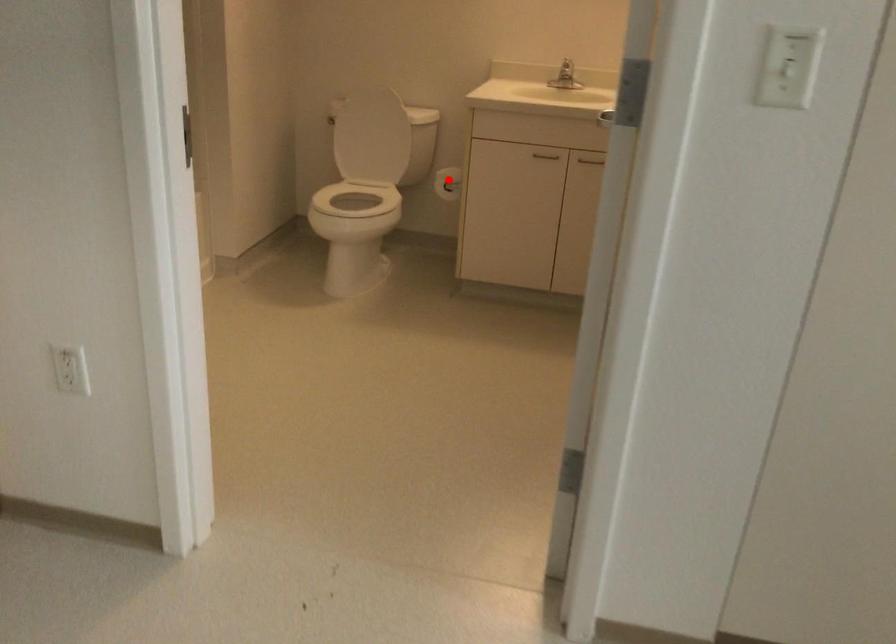
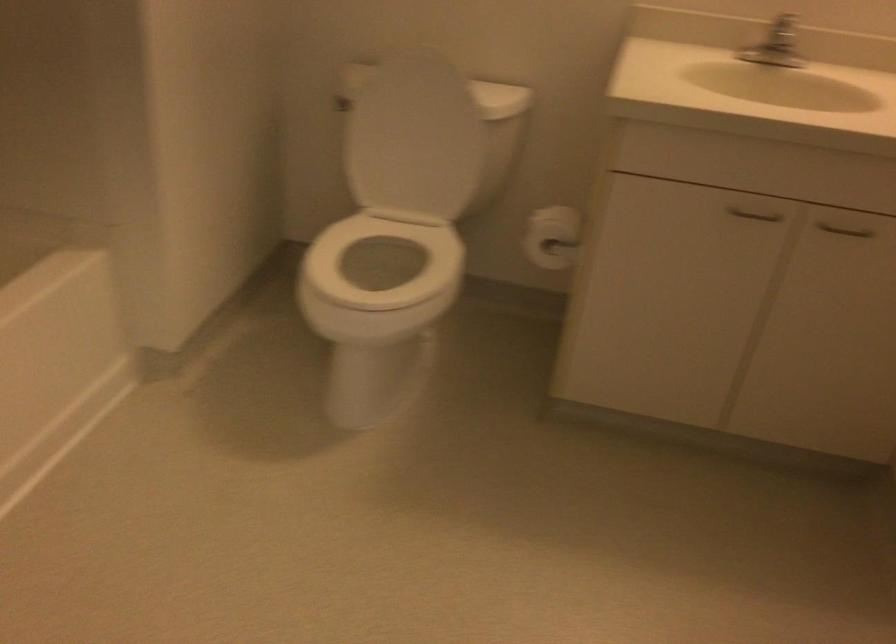
Question: A red point is marked in image1. In image2, is the corresponding 3D point closer to the camera or farther? Reply with the corresponding letter.

Choices:
 (A) The corresponding 3D point is closer.
 (B) The corresponding 3D point is farther.

Answer: (A)